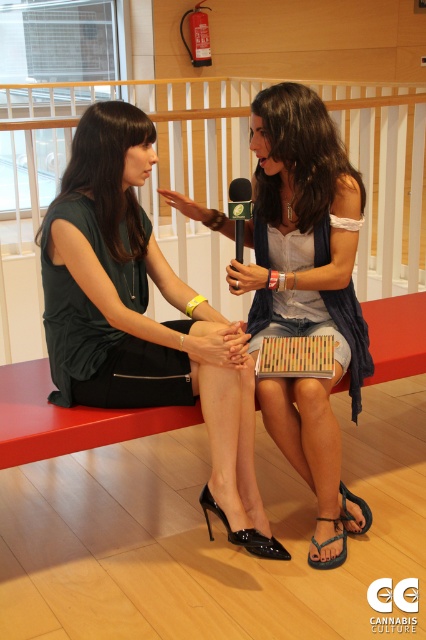
Question: Is black patent leather sandal at lower center positioned at the back of blue rubber sandal at lower center?

Choices:
 (A) no
 (B) yes

Answer: (A)

Question: Which of these objects is positioned farthest from the blue rubber sandal at lower center?

Choices:
 (A) green fabric microphone at center
 (B) matte black dress at center

Answer: (A)

Question: Does black patent leather sandal at lower center appear on the left side of blue fabric sandal at lower right?

Choices:
 (A) no
 (B) yes

Answer: (B)

Question: Is black patent leather sandal at lower center positioned behind blue rubber sandal at lower center?

Choices:
 (A) no
 (B) yes

Answer: (A)

Question: Which of the following is the closest to the observer?

Choices:
 (A) [x=325, y=561]
 (B) [x=245, y=188]
 (C) [x=100, y=129]

Answer: (C)

Question: Which of the following is the farthest from the observer?

Choices:
 (A) matte black dress at center
 (B) blue rubber sandal at lower center
 (C) blue fabric sandal at lower right
 (D) green fabric microphone at center

Answer: (C)